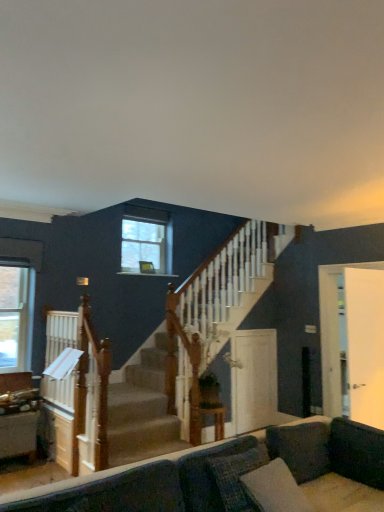
The image size is (384, 512). Describe the element at coordinates (301, 448) in the screenshot. I see `dark gray fabric pillow at lower right` at that location.

The image size is (384, 512). What are the coordinates of `clear glass window at left, the 2th window positioned from the right` in the screenshot? It's located at (18, 300).

This screenshot has width=384, height=512. What do you see at coordinates (203, 421) in the screenshot?
I see `wooden table at center` at bounding box center [203, 421].

The height and width of the screenshot is (512, 384). Find the location of `white glossy door at right, acting as the first screen door starting from the front`. white glossy door at right, acting as the first screen door starting from the front is located at coordinates (365, 344).

Where is `velvet dark gray couch at lower center`? This screenshot has height=512, width=384. velvet dark gray couch at lower center is located at coordinates (235, 475).

You are a GUI agent. You are given a task and a screenshot of the screen. Output one action in this format:
    pyautogui.click(x=<x>, y=<y>)
    Task: Click on the white glossy door at center, which is counted as the 1th screen door, starting from the left
    Image resolution: width=384 pixels, height=512 pixels.
    Given the screenshot: What is the action you would take?
    pyautogui.click(x=253, y=379)

Considering the relative positions of clear glass window at left, which ranks as the 1th window in bottom-to-top order, and white glossy door at right, acting as the first screen door starting from the front, in the image provided, is clear glass window at left, which ranks as the 1th window in bottom-to-top order, to the right of white glossy door at right, acting as the first screen door starting from the front, from the viewer's perspective?

No.

In terms of width, does clear glass window at left, the 2th window positioned from the right, look wider or thinner when compared to white glossy door at right, marked as the second screen door in a left-to-right arrangement?

In the image, clear glass window at left, the 2th window positioned from the right, appears to be more narrow than white glossy door at right, marked as the second screen door in a left-to-right arrangement.

From the image's perspective, is clear glass window at left, which is the 1th window in left-to-right order, above white glossy door at right, marked as the second screen door in a left-to-right arrangement?

Yes, from the image's perspective, clear glass window at left, which is the 1th window in left-to-right order, is above white glossy door at right, marked as the second screen door in a left-to-right arrangement.

Considering the sizes of objects clear glass window at left, acting as the 2th window starting from the top, and white glossy door at right, marked as the second screen door in a left-to-right arrangement, in the image provided, who is smaller, clear glass window at left, acting as the 2th window starting from the top, or white glossy door at right, marked as the second screen door in a left-to-right arrangement,?

Smaller between the two is clear glass window at left, acting as the 2th window starting from the top.

The image size is (384, 512). I want to click on screen door above the velvet dark gray couch at lower center (from the image's perspective), so click(365, 344).

From the image's perspective, is velvet dark gray couch at lower center below white glossy door at right, acting as the first screen door starting from the front?

Indeed, from the image's perspective, velvet dark gray couch at lower center is shown beneath white glossy door at right, acting as the first screen door starting from the front.

Is velvet dark gray couch at lower center shorter than white glossy door at right, which is the 2th screen door from back to front?

Correct, velvet dark gray couch at lower center is not as tall as white glossy door at right, which is the 2th screen door from back to front.

How many degrees apart are the facing directions of velvet dark gray couch at lower center and white glossy door at right, which is the 2th screen door from back to front?

The angular difference between velvet dark gray couch at lower center and white glossy door at right, which is the 2th screen door from back to front, is 176 degrees.

Between dark gray fabric pillow at lower right and wooden table at center, which one has larger size?

dark gray fabric pillow at lower right.

Is dark gray fabric pillow at lower right oriented away from wooden table at center?

Correct, dark gray fabric pillow at lower right is looking away from wooden table at center.

Would you say dark gray fabric pillow at lower right is outside wooden table at center?

That's correct, dark gray fabric pillow at lower right is outside of wooden table at center.

Does point (279, 452) appear closer or farther from the camera than point (209, 414)?

Point (279, 452) is closer to the camera than point (209, 414).

Looking at the image, does wooden table at center seem bigger or smaller compared to velvet dark gray couch at lower center?

In the image, wooden table at center appears to be smaller than velvet dark gray couch at lower center.

Based on the photo, from a real-world perspective, is wooden table at center above or below velvet dark gray couch at lower center?

Clearly, from a real-world perspective, wooden table at center is below velvet dark gray couch at lower center.

Would you say wooden table at center contains velvet dark gray couch at lower center?

No, velvet dark gray couch at lower center is not a part of wooden table at center.

In terms of size, does clear glass window at upper center, marked as the first window in a back-to-front arrangement, appear bigger or smaller than white glossy door at right, arranged as the first screen door when viewed from the right?

In the image, clear glass window at upper center, marked as the first window in a back-to-front arrangement, appears to be smaller than white glossy door at right, arranged as the first screen door when viewed from the right.

Who is taller, clear glass window at upper center, positioned as the 1th window in top-to-bottom order, or white glossy door at right, acting as the first screen door starting from the front?

white glossy door at right, acting as the first screen door starting from the front.

From the image's perspective, is clear glass window at upper center, marked as the first window in a back-to-front arrangement, located above or below white glossy door at right, acting as the first screen door starting from the front?

clear glass window at upper center, marked as the first window in a back-to-front arrangement, is above white glossy door at right, acting as the first screen door starting from the front.

Measure the distance from dark gray fabric pillow at lower right to white glossy door at right, acting as the first screen door starting from the front.

A distance of 4.18 feet exists between dark gray fabric pillow at lower right and white glossy door at right, acting as the first screen door starting from the front.

How many degrees apart are the facing directions of dark gray fabric pillow at lower right and white glossy door at right, arranged as the first screen door when viewed from the right?

The angular difference between dark gray fabric pillow at lower right and white glossy door at right, arranged as the first screen door when viewed from the right, is 174 degrees.

Are dark gray fabric pillow at lower right and white glossy door at right, which is the 2th screen door from back to front, far apart?

That's right, there is a large distance between dark gray fabric pillow at lower right and white glossy door at right, which is the 2th screen door from back to front.

Consider the image. Which is in front, dark gray fabric pillow at lower right or white glossy door at right, acting as the first screen door starting from the front?

dark gray fabric pillow at lower right is in front.

Is white glossy door at right, acting as the first screen door starting from the front, in contact with clear glass window at upper center, the second window in the front-to-back sequence?

They are not placed beside each other.

Considering the positions of objects white glossy door at right, which is the 2th screen door from back to front, and clear glass window at upper center, the second window in the front-to-back sequence, in the image provided, who is behind, white glossy door at right, which is the 2th screen door from back to front, or clear glass window at upper center, the second window in the front-to-back sequence,?

clear glass window at upper center, the second window in the front-to-back sequence, is further from the camera.

From a real-world perspective, is white glossy door at right, which is the 2th screen door from back to front, positioned over clear glass window at upper center, arranged as the 2th window when viewed from the left, based on gravity?

Actually, white glossy door at right, which is the 2th screen door from back to front, is physically below clear glass window at upper center, arranged as the 2th window when viewed from the left, in the real world.

From the image's perspective, is white glossy door at right, which is the 2th screen door from back to front, positioned above or below clear glass window at upper center, positioned as the 1th window in top-to-bottom order?

white glossy door at right, which is the 2th screen door from back to front, is below clear glass window at upper center, positioned as the 1th window in top-to-bottom order.

You are a GUI agent. You are given a task and a screenshot of the screen. Output one action in this format:
    pyautogui.click(x=<x>, y=<y>)
    Task: Click on the screen door in front of the clear glass window at left, which ranks as the 1th window in bottom-to-top order
    
    Given the screenshot: What is the action you would take?
    pyautogui.click(x=365, y=344)

This screenshot has width=384, height=512. Identify the location of studio couch below the white glossy door at right, arranged as the first screen door when viewed from the right (from a real-world perspective). (235, 475).

Estimate the real-world distances between objects in this image. Which object is closer to velvet dark gray couch at lower center, white glossy door at right, marked as the second screen door in a left-to-right arrangement, or clear glass window at upper center, which appears as the 1th window when viewed from the right?

Based on the image, white glossy door at right, marked as the second screen door in a left-to-right arrangement, appears to be nearer to velvet dark gray couch at lower center.

Estimate the real-world distances between objects in this image. Which object is closer to clear glass window at left, the 2th window positioned from the right, white glossy door at center, the 2th screen door viewed from the front, or clear glass window at upper center, which appears as the 1th window when viewed from the right?

Based on the image, clear glass window at upper center, which appears as the 1th window when viewed from the right, appears to be nearer to clear glass window at left, the 2th window positioned from the right.

Based on their spatial positions, is white glossy door at right, which is the 2th screen door from back to front, or clear glass window at left, which ranks as the 1th window in bottom-to-top order, further from velvet dark gray couch at lower center?

clear glass window at left, which ranks as the 1th window in bottom-to-top order, is further to velvet dark gray couch at lower center.

Looking at the image, which one is located closer to clear glass window at left, acting as the 2th window starting from the top, wooden table at center or white glossy door at right, which is the 2th screen door from back to front?

wooden table at center is closer to clear glass window at left, acting as the 2th window starting from the top.

Considering their positions, is dark gray fabric pillow at lower right positioned closer to clear glass window at upper center, which appears as the 1th window when viewed from the right, than clear glass window at left, the 2th window positioned from the right?

Among the two, clear glass window at left, the 2th window positioned from the right, is located nearer to clear glass window at upper center, which appears as the 1th window when viewed from the right.

Considering their positions, is white glossy door at center, the 2th screen door viewed from the front, positioned further to velvet dark gray couch at lower center than white glossy door at right, arranged as the first screen door when viewed from the right?

white glossy door at center, the 2th screen door viewed from the front, lies further to velvet dark gray couch at lower center than the other object.

From the image, which object appears to be farther from clear glass window at upper center, marked as the first window in a back-to-front arrangement, wooden table at center or white glossy door at center, the 1th screen door positioned from the back?

wooden table at center lies further to clear glass window at upper center, marked as the first window in a back-to-front arrangement, than the other object.

Which object lies further to the anchor point velvet dark gray couch at lower center, wooden table at center or white glossy door at center, which is counted as the second screen door, starting from the right?

Among the two, white glossy door at center, which is counted as the second screen door, starting from the right, is located further to velvet dark gray couch at lower center.

The height and width of the screenshot is (512, 384). In order to click on pillow between velvet dark gray couch at lower center and clear glass window at upper center, arranged as the 2th window when viewed from the left, in the front-back direction in this screenshot , I will do `click(301, 448)`.

Find the location of a particular element. The width and height of the screenshot is (384, 512). window located between velvet dark gray couch at lower center and clear glass window at upper center, marked as the 2th window in a bottom-to-top arrangement, in the depth direction is located at coordinates (18, 300).

Find the location of `pillow between velvet dark gray couch at lower center and white glossy door at center, which is counted as the second screen door, starting from the right, in the front-back direction`. pillow between velvet dark gray couch at lower center and white glossy door at center, which is counted as the second screen door, starting from the right, in the front-back direction is located at coordinates (301, 448).

The height and width of the screenshot is (512, 384). I want to click on screen door between wooden table at center and white glossy door at right, marked as the second screen door in a left-to-right arrangement, so click(253, 379).